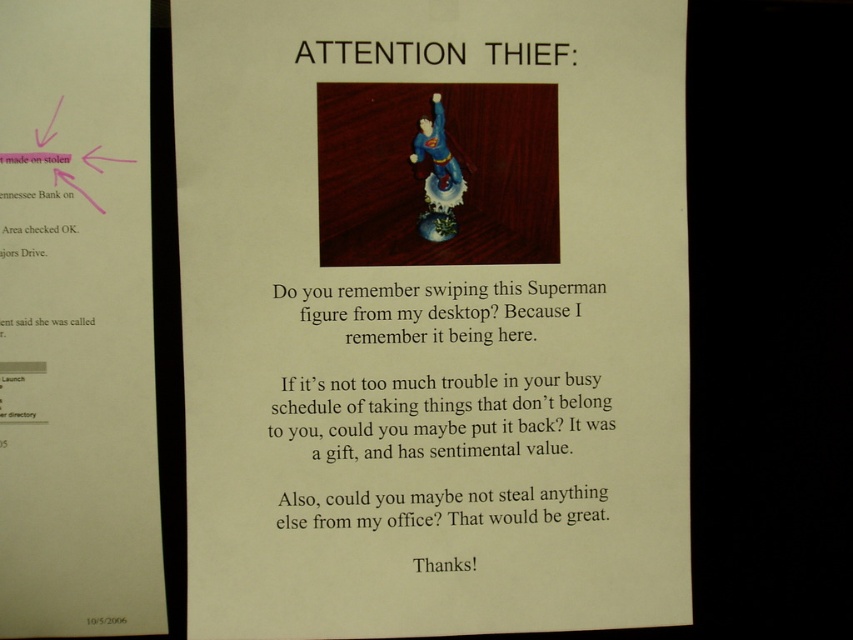
Question: Which object is closer to the camera taking this photo?

Choices:
 (A) porcelain superman figure at center
 (B) matte plastic superman figure at center

Answer: (A)

Question: Which object appears farthest from the camera in this image?

Choices:
 (A) porcelain superman figure at center
 (B) matte paper poster at upper left
 (C) matte plastic superman figure at center

Answer: (C)

Question: Can you confirm if matte paper poster at upper left is thinner than matte plastic superman figure at center?

Choices:
 (A) no
 (B) yes

Answer: (B)

Question: Which object appears closest to the camera in this image?

Choices:
 (A) porcelain superman figure at center
 (B) matte plastic superman figure at center
 (C) matte paper poster at upper left

Answer: (C)

Question: Does porcelain superman figure at center appear on the left side of matte plastic superman figure at center?

Choices:
 (A) yes
 (B) no

Answer: (A)

Question: Is porcelain superman figure at center above matte plastic superman figure at center?

Choices:
 (A) no
 (B) yes

Answer: (B)